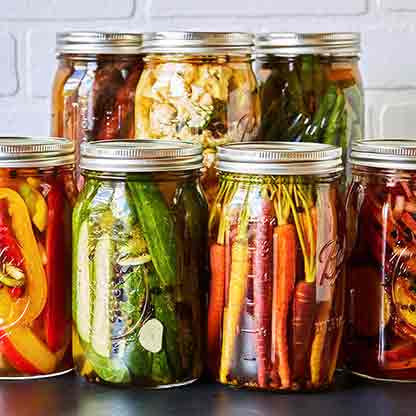
The width and height of the screenshot is (416, 416). Find the location of `jar lids`. jar lids is located at coordinates (302, 44), (381, 155), (249, 161), (146, 152), (42, 141), (100, 48), (185, 51).